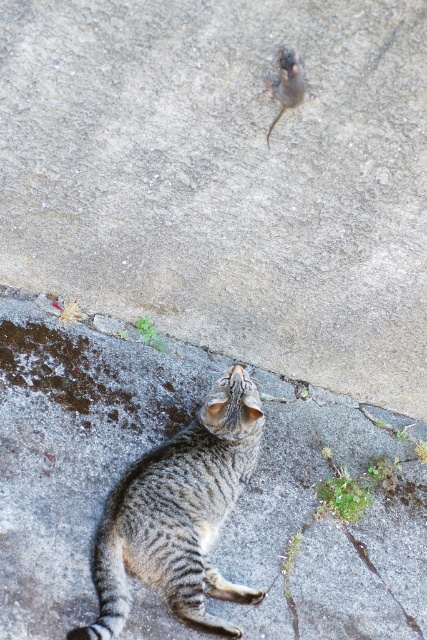
You are a small animal trying to cross the concrete area. You see the gray concrete at lower center and the gray stone crack at lower right. Which one is closer to you as you approach from the front?

The gray concrete at lower center is closer to you because it is in front of the gray stone crack at lower right.

In the scene shown: You are a photographer trying to capture the cat and mouse scene. You notice two points marked in the image. The first point is at coordinate point(325, 552) and the second is at point(195, 472). Which point is closer to your camera lens?

Point(195, 472) is closer to the camera lens because it is less further than point(325, 552).